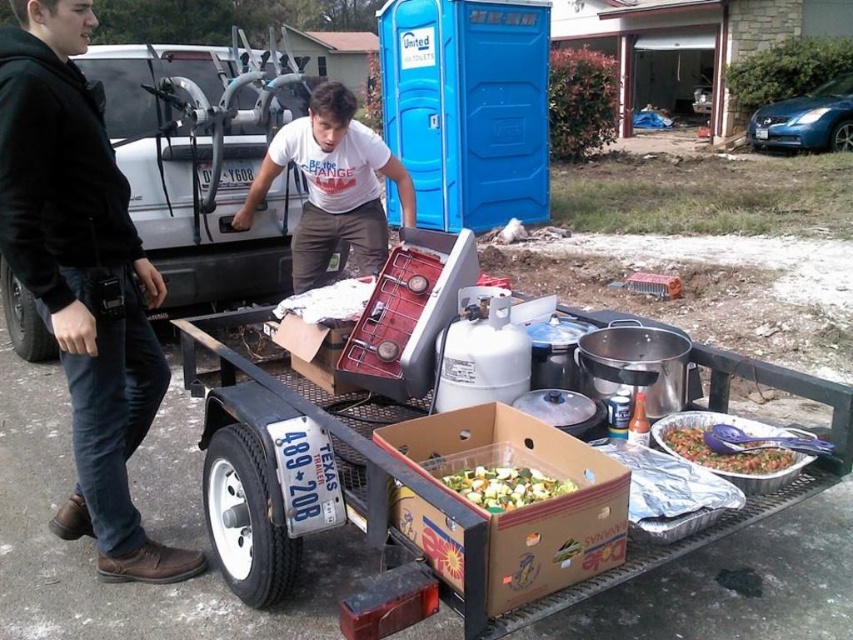
What is located at the coordinates point (x=83, y=276)?

A black cotton hoodie at left is located at point (x=83, y=276).

In the scene shown: You are a food vendor setting up for an event. You have a black cotton hoodie at left and tomato salsa in aluminum pan at lower right. Which item is positioned higher from the ground?

The black cotton hoodie at left is above the tomato salsa in aluminum pan at lower right, so the hoodie is higher up.